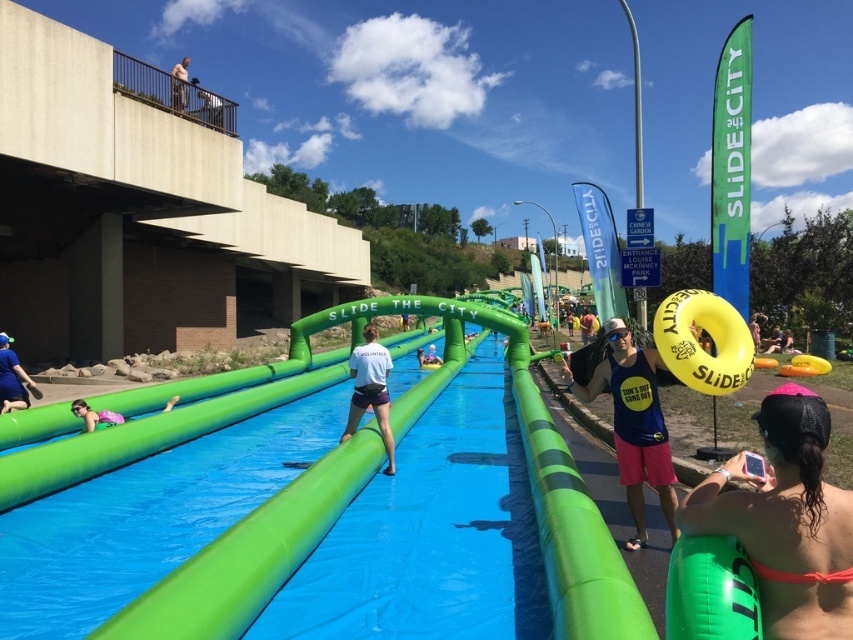
Question: Which object appears closest to the camera in this image?

Choices:
 (A) white matte shirt at center
 (B) skinny jeans at upper left

Answer: (A)

Question: Does blue fabric shirt at lower left have a lesser width compared to pink fabric at lower left?

Choices:
 (A) yes
 (B) no

Answer: (A)

Question: Which object appears closest to the camera in this image?

Choices:
 (A) light blue fabric tube at center
 (B) skinny jeans at upper left
 (C) white matte shirt at center

Answer: (C)

Question: Is blue fabric shirt at lower left to the left of skinny jeans at upper left from the viewer's perspective?

Choices:
 (A) no
 (B) yes

Answer: (A)

Question: Can you confirm if pink fabric at lower left is positioned to the left of skinny jeans at upper left?

Choices:
 (A) yes
 (B) no

Answer: (B)

Question: Which point is farther from the camera taking this photo?

Choices:
 (A) (6, 353)
 (B) (422, 364)
 (C) (595, 388)

Answer: (B)